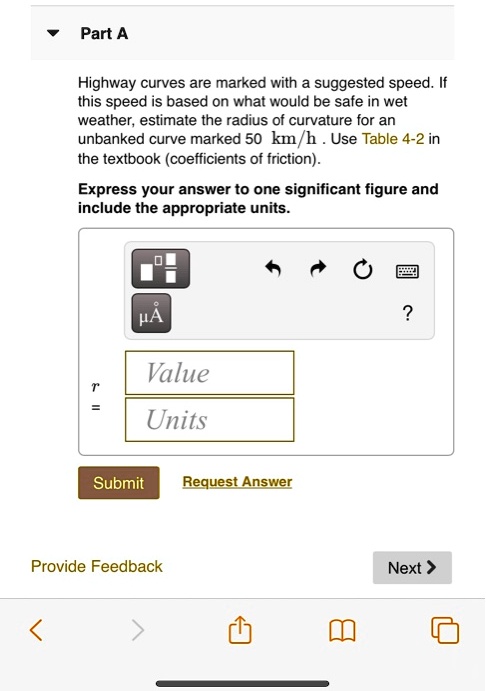
You are a GUI agent. You are given a task and a screenshot of the screen. Output one action in this format:
    pyautogui.click(x=<x>, y=<y>)
    Task: Click on the unit entry
    The image size is (486, 691).
    Given the screenshot: What is the action you would take?
    pyautogui.click(x=175, y=421)